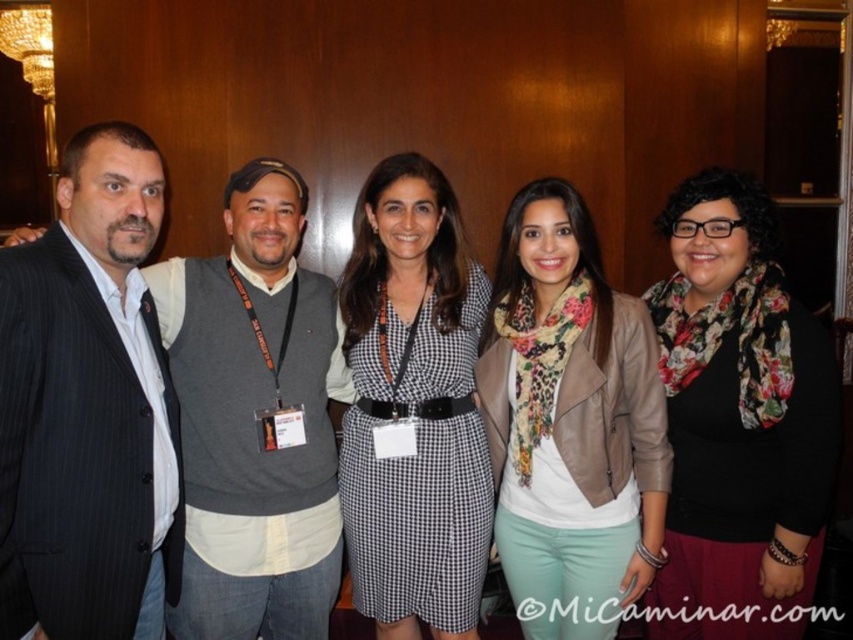
Is floral scarf at center to the right of black checkered dress at center from the viewer's perspective?

Yes, floral scarf at center is to the right of black checkered dress at center.

Which is behind, point (793, 636) or point (397, 168)?

Positioned behind is point (397, 168).

Locate an element on the screen. The height and width of the screenshot is (640, 853). floral scarf at center is located at coordinates (740, 417).

At what (x,y) coordinates should I click in order to perform the action: click on floral scarf at center. Please return your answer as a coordinate pair (x, y). The width and height of the screenshot is (853, 640). Looking at the image, I should click on (740, 417).

Is floral scarf at center positioned before brown leather jacket at center?

Yes, floral scarf at center is in front of brown leather jacket at center.

Between floral scarf at center and brown leather jacket at center, which one appears on the left side from the viewer's perspective?

From the viewer's perspective, brown leather jacket at center appears more on the left side.

Which is in front, point (720, 394) or point (641, 454)?

Point (720, 394)

At what (x,y) coordinates should I click in order to perform the action: click on floral scarf at center. Please return your answer as a coordinate pair (x, y). Looking at the image, I should click on (740, 417).

Is matte black suit at left behind brown leather jacket at center?

Yes, it is.

Based on the photo, is the position of matte black suit at left less distant than that of brown leather jacket at center?

No, matte black suit at left is behind brown leather jacket at center.

Find the location of a particular element. The width and height of the screenshot is (853, 640). matte black suit at left is located at coordinates (254, 419).

Identify the location of matte black suit at left. 254,419.